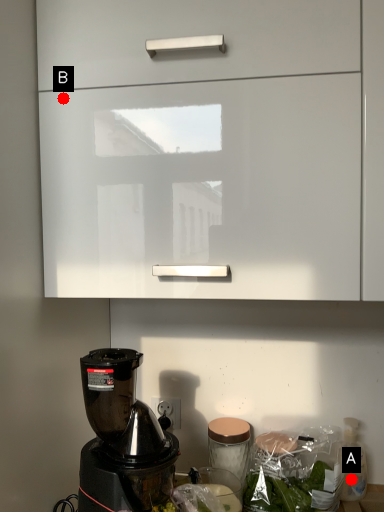
Question: Two points are circled on the image, labeled by A and B beside each circle. Which point is closer to the camera taking this photo?

Choices:
 (A) A is closer
 (B) B is closer

Answer: (B)